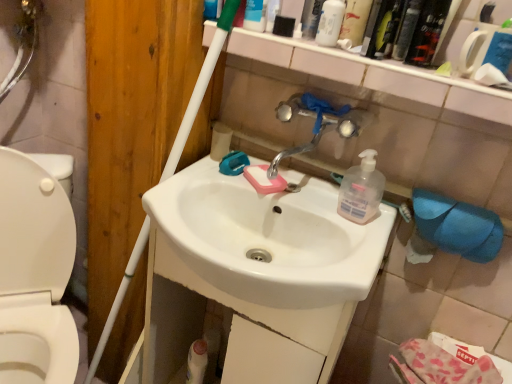
Find the location of a particular element. empty space that is in between translucent plastic mouthwash at upper right, the 3th mouthwash positioned from the right, and white plastic bottle at upper center, the 1th toiletry from the left is located at coordinates (305, 42).